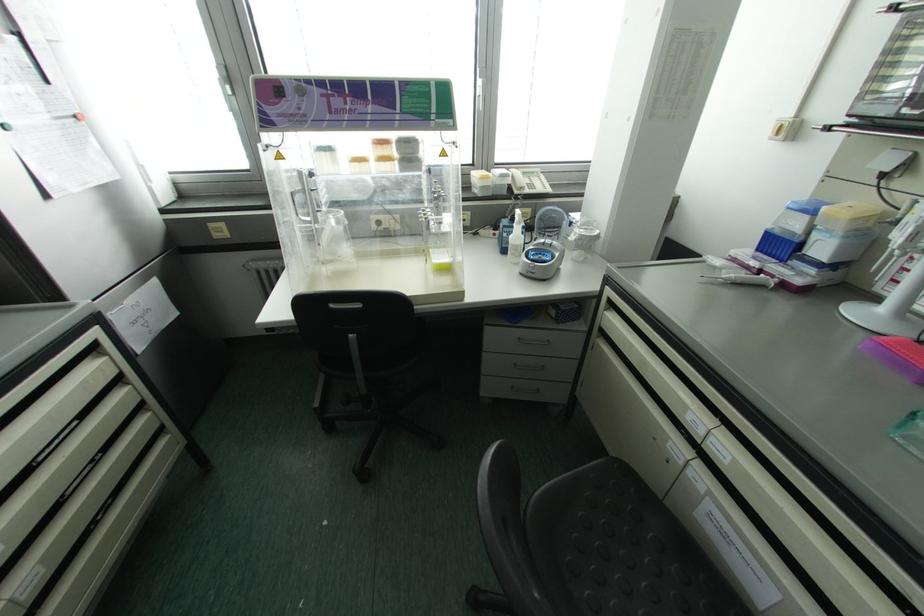
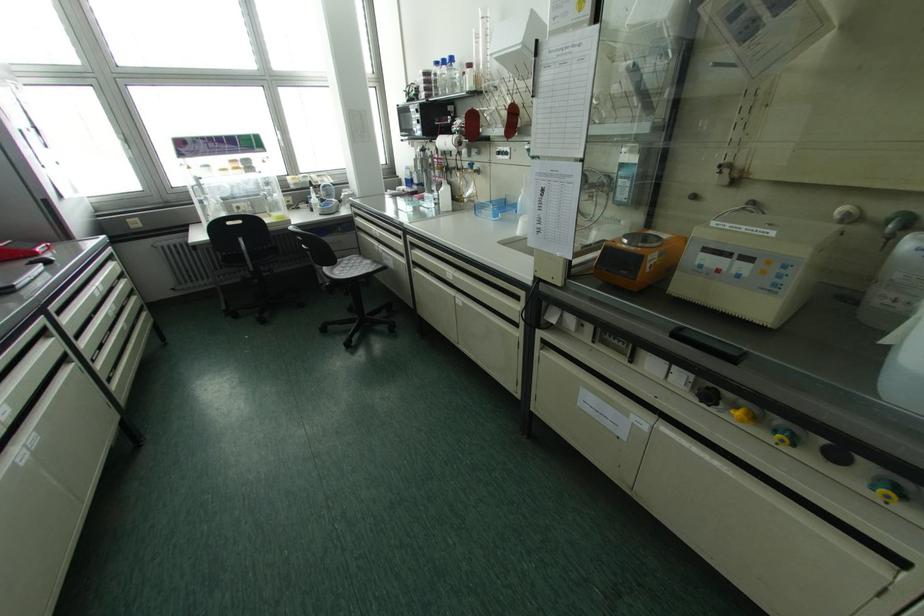
Where in the second image is the point corresponding to (222,225) from the first image?

(137, 219)